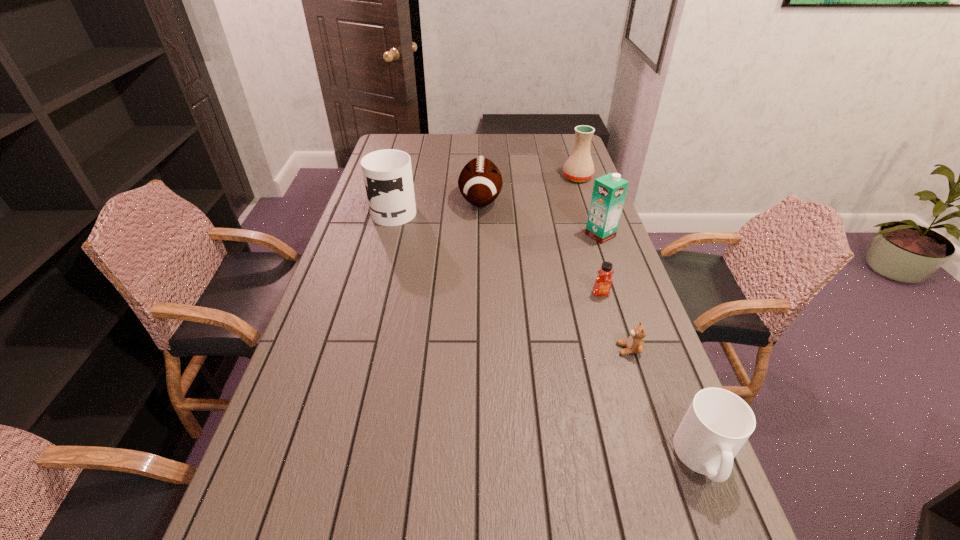
Locate an element on the screen. The height and width of the screenshot is (540, 960). vacant spot for a new mug to ensure equal spacing is located at coordinates (506, 299).